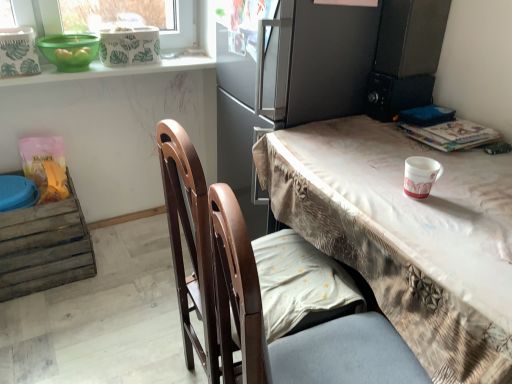
Find the location of a particular element. free space above floral-patterned fabric table at right (from a real-world perspective) is located at coordinates (406, 184).